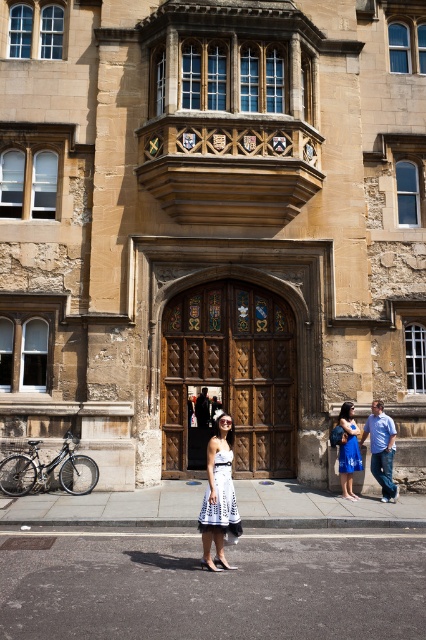
Question: Can you confirm if white lace dress at center is positioned to the left of white cotton dress at center?

Choices:
 (A) no
 (B) yes

Answer: (B)

Question: Among these points, which one is nearest to the camera?

Choices:
 (A) (356, 426)
 (B) (339, 420)
 (C) (294, 419)
 (D) (393, 442)

Answer: (D)

Question: Can you confirm if blue denim jeans at lower right is thinner than white cotton dress at center?

Choices:
 (A) yes
 (B) no

Answer: (B)

Question: Which object is the closest to the blue denim jeans at lower right?

Choices:
 (A) wooden door at center
 (B) white cotton dress at center

Answer: (B)

Question: Considering the real-world distances, which object is closest to the blue satin dress at center?

Choices:
 (A) blue denim jeans at lower right
 (B) white cotton dress at center
 (C) wooden door at center

Answer: (B)

Question: Is the position of white lace dress at center less distant than that of blue satin dress at center?

Choices:
 (A) yes
 (B) no

Answer: (A)